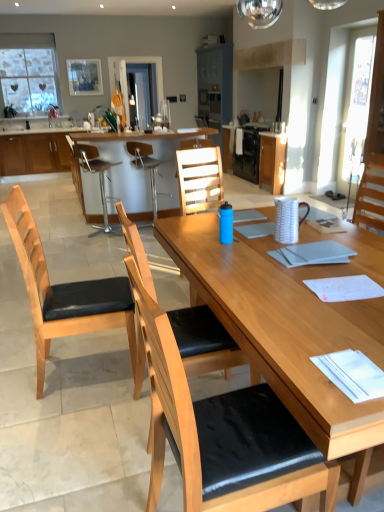
This screenshot has width=384, height=512. Identify the location of vacant space situated on the left part of light wood chair with black cushion at left, placed as the 3th chair when sorted from back to front. (17, 371).